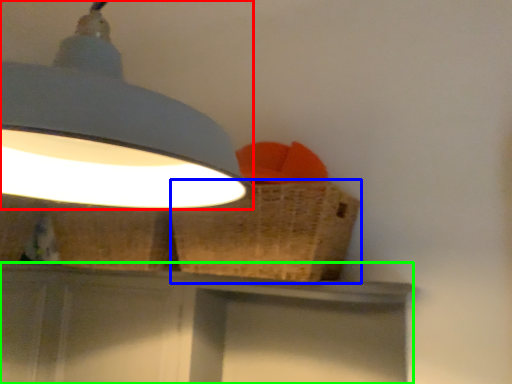
Question: Considering the real-world distances, which object is farthest from lamp (highlighted by a red box)? basket (highlighted by a blue box) or vanity (highlighted by a green box)?

Choices:
 (A) basket
 (B) vanity

Answer: (B)